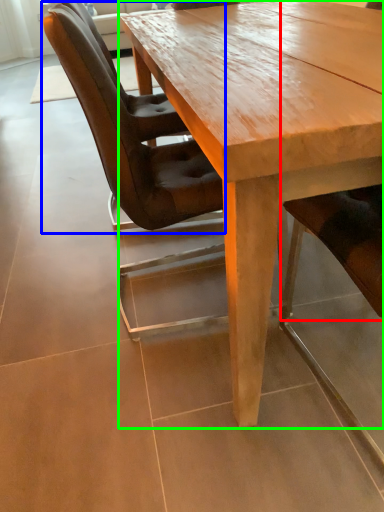
Question: Which is nearer to the chair (highlighted by a red box)? chair (highlighted by a blue box) or coffee table (highlighted by a green box).

Choices:
 (A) chair
 (B) coffee table

Answer: (B)